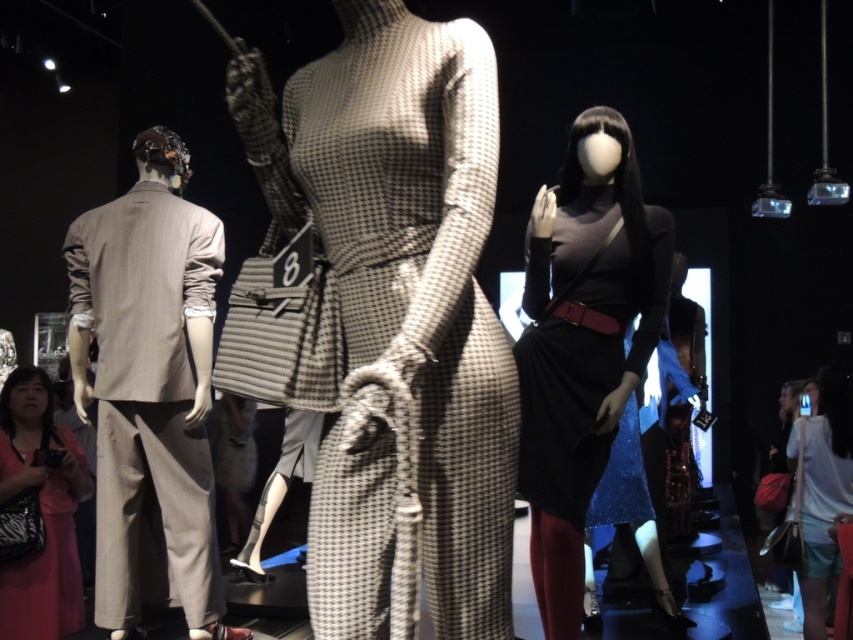
Is houndstooth fabric dress at center smaller than matte black dress at center?

Actually, houndstooth fabric dress at center might be larger than matte black dress at center.

Who is lower down, houndstooth fabric dress at center or matte black dress at center?

matte black dress at center

Between point (442, 244) and point (558, 243), which one is positioned behind?

The point (558, 243) is behind.

Locate an element on the screen. The image size is (853, 640). houndstooth fabric dress at center is located at coordinates (399, 317).

Can you confirm if houndstooth fabric dress at center is taller than pink fabric dress at lower left?

Correct, houndstooth fabric dress at center is much taller as pink fabric dress at lower left.

Can you confirm if houndstooth fabric dress at center is bigger than pink fabric dress at lower left?

No, houndstooth fabric dress at center is not bigger than pink fabric dress at lower left.

What are the coordinates of `houndstooth fabric dress at center` in the screenshot? It's located at (399, 317).

Which is below, matte black dress at center or pink fabric dress at lower left?

A: Positioned lower is pink fabric dress at lower left.

Find the location of a particular element. matte black dress at center is located at coordinates tap(584, 349).

The height and width of the screenshot is (640, 853). Identify the location of matte black dress at center. (584, 349).